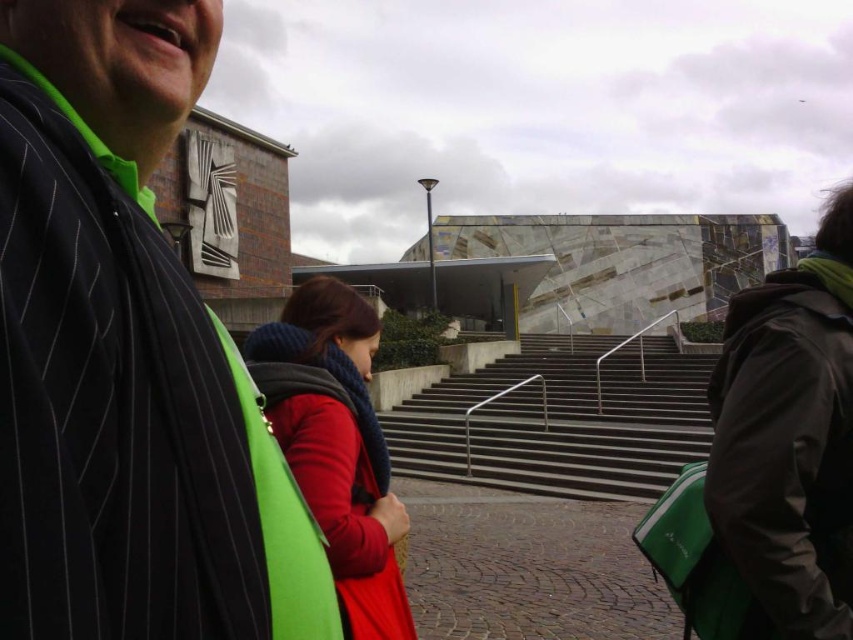
Which is behind, point (177, 440) or point (842, 484)?

The point (842, 484) is more distant.

What do you see at coordinates (126, 358) in the screenshot? The image size is (853, 640). I see `striped fabric jacket at upper left` at bounding box center [126, 358].

Locate an element on the screen. This screenshot has width=853, height=640. striped fabric jacket at upper left is located at coordinates (126, 358).

Is striped fabric jacket at upper left thinner than slate gray concrete stairs at center?

Yes.

Is striped fabric jacket at upper left above slate gray concrete stairs at center?

Yes.

Where is `striped fabric jacket at upper left`? The image size is (853, 640). striped fabric jacket at upper left is located at coordinates (126, 358).

This screenshot has height=640, width=853. I want to click on striped fabric jacket at upper left, so click(126, 358).

Can you confirm if dark gray matte jacket at right is positioned below red wool scarf at center?

No.

Can you confirm if dark gray matte jacket at right is thinner than red wool scarf at center?

Yes.

Who is more distant from viewer, (709,474) or (335,413)?

The point (335,413) is more distant.

Locate an element on the screen. This screenshot has width=853, height=640. dark gray matte jacket at right is located at coordinates (786, 451).